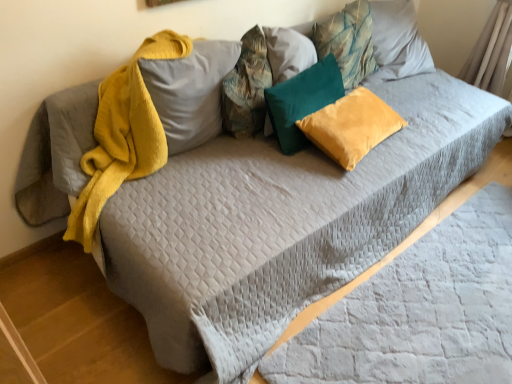
This screenshot has width=512, height=384. Describe the element at coordinates (302, 101) in the screenshot. I see `teal velvet pillow at center, which ranks as the 3th pillow in left-to-right order` at that location.

This screenshot has height=384, width=512. Find the location of `fuzzy yellow pillow at upper center, which ranks as the 5th pillow in right-to-left order`. fuzzy yellow pillow at upper center, which ranks as the 5th pillow in right-to-left order is located at coordinates (190, 92).

Find the location of a particular element. The width and height of the screenshot is (512, 384). textured fabric pillow at center, positioned as the second pillow in left-to-right order is located at coordinates (246, 87).

What do you see at coordinates (348, 42) in the screenshot? The width and height of the screenshot is (512, 384). I see `teal fabric pillow at upper center, the 1th pillow viewed from the right` at bounding box center [348, 42].

This screenshot has width=512, height=384. What do you see at coordinates (420, 311) in the screenshot? I see `gray quilted sheet at lower right` at bounding box center [420, 311].

I want to click on velvet yellow pillow at center, which is the second pillow in right-to-left order, so click(351, 126).

Is fuzzy yellow pillow at upper center, which ranks as the 5th pillow in right-to-left order, positioned with its back to velvet yellow pillow at center, which is the second pillow in right-to-left order?

No, fuzzy yellow pillow at upper center, which ranks as the 5th pillow in right-to-left order, is not facing the opposite direction of velvet yellow pillow at center, which is the second pillow in right-to-left order.

From a real-world perspective, is fuzzy yellow pillow at upper center, which is the first pillow from left to right, located higher than velvet yellow pillow at center, which is the second pillow in right-to-left order?

Indeed, from a real-world perspective, fuzzy yellow pillow at upper center, which is the first pillow from left to right, stands above velvet yellow pillow at center, which is the second pillow in right-to-left order.

Is fuzzy yellow pillow at upper center, which is the first pillow from left to right, smaller than velvet yellow pillow at center, which is the second pillow in right-to-left order?

Incorrect, fuzzy yellow pillow at upper center, which is the first pillow from left to right, is not smaller in size than velvet yellow pillow at center, which is the second pillow in right-to-left order.

Can you see velvet yellow pillow at center, which is the second pillow in right-to-left order, touching textured fabric pillow at center, the fourth pillow positioned from the right?

They are not placed beside each other.

Does velvet yellow pillow at center, which is the second pillow in right-to-left order, have a lesser width compared to textured fabric pillow at center, the fourth pillow positioned from the right?

No, velvet yellow pillow at center, which is the second pillow in right-to-left order, is not thinner than textured fabric pillow at center, the fourth pillow positioned from the right.

From a real-world perspective, which pillow is the 4th one underneath the textured fabric pillow at center, positioned as the second pillow in left-to-right order? Please provide its 2D coordinates.

[(351, 126)]

Between velvet yellow pillow at center, placed as the fourth pillow when sorted from left to right, and textured fabric pillow at center, positioned as the second pillow in left-to-right order, which one appears on the left side from the viewer's perspective?

textured fabric pillow at center, positioned as the second pillow in left-to-right order.

Considering the sizes of textured fabric pillow at center, positioned as the second pillow in left-to-right order, and fuzzy yellow pillow at upper center, which ranks as the 5th pillow in right-to-left order, in the image, is textured fabric pillow at center, positioned as the second pillow in left-to-right order, wider or thinner than fuzzy yellow pillow at upper center, which ranks as the 5th pillow in right-to-left order,?

Clearly, textured fabric pillow at center, positioned as the second pillow in left-to-right order, has less width compared to fuzzy yellow pillow at upper center, which ranks as the 5th pillow in right-to-left order.

Is textured fabric pillow at center, the fourth pillow positioned from the right, situated inside fuzzy yellow pillow at upper center, which ranks as the 5th pillow in right-to-left order, or outside?

textured fabric pillow at center, the fourth pillow positioned from the right, fits inside fuzzy yellow pillow at upper center, which ranks as the 5th pillow in right-to-left order.

Who is shorter, textured fabric pillow at center, positioned as the second pillow in left-to-right order, or fuzzy yellow pillow at upper center, which is the first pillow from left to right?

With less height is fuzzy yellow pillow at upper center, which is the first pillow from left to right.

Considering the positions of objects textured fabric pillow at center, the fourth pillow positioned from the right, and fuzzy yellow pillow at upper center, which is the first pillow from left to right, in the image provided, who is more to the left, textured fabric pillow at center, the fourth pillow positioned from the right, or fuzzy yellow pillow at upper center, which is the first pillow from left to right,?

fuzzy yellow pillow at upper center, which is the first pillow from left to right, is more to the left.

Locate an element on the screen. the 2nd pillow positioned above the teal velvet pillow at center, the 3th pillow viewed from the right (from the image's perspective) is located at coordinates tap(348, 42).

Between teal fabric pillow at upper center, placed as the 5th pillow when sorted from left to right, and teal velvet pillow at center, the 3th pillow viewed from the right, which one is positioned in front?

Positioned in front is teal velvet pillow at center, the 3th pillow viewed from the right.

Is teal fabric pillow at upper center, the 1th pillow viewed from the right, spatially inside teal velvet pillow at center, which ranks as the 3th pillow in left-to-right order, or outside of it?

teal fabric pillow at upper center, the 1th pillow viewed from the right, is outside teal velvet pillow at center, which ranks as the 3th pillow in left-to-right order.

Who is shorter, textured fabric pillow at center, positioned as the second pillow in left-to-right order, or gray quilted sheet at lower right?

With less height is gray quilted sheet at lower right.

From a real-world perspective, which is physically above, textured fabric pillow at center, the fourth pillow positioned from the right, or gray quilted sheet at lower right?

textured fabric pillow at center, the fourth pillow positioned from the right, is physically above.

Would you say textured fabric pillow at center, the fourth pillow positioned from the right, is inside or outside gray quilted sheet at lower right?

textured fabric pillow at center, the fourth pillow positioned from the right, is not inside gray quilted sheet at lower right, it's outside.

Is textured fabric pillow at center, positioned as the second pillow in left-to-right order, at the right side of gray quilted sheet at lower right?

In fact, textured fabric pillow at center, positioned as the second pillow in left-to-right order, is to the left of gray quilted sheet at lower right.

Can textured fabric pillow at center, the fourth pillow positioned from the right, be found inside teal fabric pillow at upper center, the 1th pillow viewed from the right?

No, textured fabric pillow at center, the fourth pillow positioned from the right, is not a part of teal fabric pillow at upper center, the 1th pillow viewed from the right.

Is teal fabric pillow at upper center, the 1th pillow viewed from the right, not close to textured fabric pillow at center, the fourth pillow positioned from the right?

No, teal fabric pillow at upper center, the 1th pillow viewed from the right, is not far from textured fabric pillow at center, the fourth pillow positioned from the right.

Does teal fabric pillow at upper center, placed as the 5th pillow when sorted from left to right, have a lesser height compared to textured fabric pillow at center, positioned as the second pillow in left-to-right order?

No, teal fabric pillow at upper center, placed as the 5th pillow when sorted from left to right, is not shorter than textured fabric pillow at center, positioned as the second pillow in left-to-right order.

Based on the photo, who is more distant, velvet yellow pillow at center, which is the second pillow in right-to-left order, or gray quilted sheet at lower right?

velvet yellow pillow at center, which is the second pillow in right-to-left order, is further away from the camera.

Identify the location of sheet beneath the velvet yellow pillow at center, placed as the fourth pillow when sorted from left to right (from a real-world perspective). The image size is (512, 384). coord(420,311).

Is gray quilted sheet at lower right surrounded by velvet yellow pillow at center, placed as the fourth pillow when sorted from left to right?

No, gray quilted sheet at lower right is not surrounded by velvet yellow pillow at center, placed as the fourth pillow when sorted from left to right.

In order to click on pillow that is the 1st object located above the velvet yellow pillow at center, which is the second pillow in right-to-left order (from the image's perspective) in this screenshot , I will do point(190,92).

You are a GUI agent. You are given a task and a screenshot of the screen. Output one action in this format:
    pyautogui.click(x=<x>, y=<y>)
    Task: Click on the 4th pillow below the textured fabric pillow at center, positioned as the second pillow in left-to-right order (from a real-world perspective)
    Image resolution: width=512 pixels, height=384 pixels.
    Given the screenshot: What is the action you would take?
    pyautogui.click(x=351, y=126)

In the scene shown: From the image, which object appears to be nearer to gray quilted sheet at lower right, velvet yellow pillow at center, placed as the fourth pillow when sorted from left to right, or fuzzy yellow pillow at upper center, which is the first pillow from left to right?

Based on the image, velvet yellow pillow at center, placed as the fourth pillow when sorted from left to right, appears to be nearer to gray quilted sheet at lower right.

Estimate the real-world distances between objects in this image. Which object is further from fuzzy yellow pillow at upper center, which ranks as the 5th pillow in right-to-left order, gray quilted sheet at lower right or teal velvet pillow at center, which ranks as the 3th pillow in left-to-right order?

gray quilted sheet at lower right.

From the image, which object appears to be nearer to teal fabric pillow at upper center, the 1th pillow viewed from the right, teal velvet pillow at center, which ranks as the 3th pillow in left-to-right order, or gray quilted sheet at lower right?

The object closer to teal fabric pillow at upper center, the 1th pillow viewed from the right, is teal velvet pillow at center, which ranks as the 3th pillow in left-to-right order.

From the image, which object appears to be nearer to textured fabric pillow at center, positioned as the second pillow in left-to-right order, velvet yellow pillow at center, placed as the fourth pillow when sorted from left to right, or gray quilted sheet at lower right?

Based on the image, velvet yellow pillow at center, placed as the fourth pillow when sorted from left to right, appears to be nearer to textured fabric pillow at center, positioned as the second pillow in left-to-right order.

Which object lies nearer to the anchor point velvet yellow pillow at center, placed as the fourth pillow when sorted from left to right, gray quilted sheet at lower right or teal fabric pillow at upper center, placed as the 5th pillow when sorted from left to right?

teal fabric pillow at upper center, placed as the 5th pillow when sorted from left to right, is closer to velvet yellow pillow at center, placed as the fourth pillow when sorted from left to right.

Looking at the image, which one is located closer to teal velvet pillow at center, the 3th pillow viewed from the right, gray quilted sheet at lower right or textured fabric pillow at center, the fourth pillow positioned from the right?

textured fabric pillow at center, the fourth pillow positioned from the right, is closer to teal velvet pillow at center, the 3th pillow viewed from the right.

Considering their positions, is velvet yellow pillow at center, which is the second pillow in right-to-left order, positioned closer to teal velvet pillow at center, which ranks as the 3th pillow in left-to-right order, than fuzzy yellow pillow at upper center, which ranks as the 5th pillow in right-to-left order?

The object closer to teal velvet pillow at center, which ranks as the 3th pillow in left-to-right order, is velvet yellow pillow at center, which is the second pillow in right-to-left order.

Considering their positions, is textured fabric pillow at center, the fourth pillow positioned from the right, positioned further to velvet yellow pillow at center, which is the second pillow in right-to-left order, than teal fabric pillow at upper center, the 1th pillow viewed from the right?

teal fabric pillow at upper center, the 1th pillow viewed from the right.

Locate an element on the screen. pillow situated between textured fabric pillow at center, positioned as the second pillow in left-to-right order, and velvet yellow pillow at center, placed as the fourth pillow when sorted from left to right, from left to right is located at coordinates (302, 101).

The width and height of the screenshot is (512, 384). What are the coordinates of `pillow situated between fuzzy yellow pillow at upper center, which ranks as the 5th pillow in right-to-left order, and teal velvet pillow at center, which ranks as the 3th pillow in left-to-right order, from left to right` in the screenshot? It's located at (246, 87).